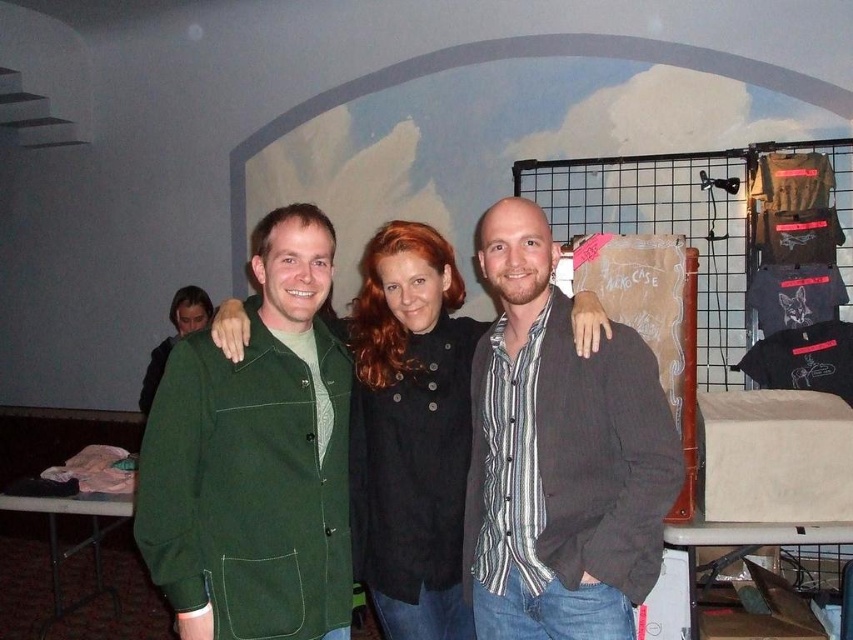
Based on the photo, you are a photographer trying to adjust the lighting for a group photo. You notice the green corduroy jacket at center and the striped cotton shirt at center. Which clothing item is narrower in width?

The green corduroy jacket at center is thinner than the striped cotton shirt at center, so the green corduroy jacket at center is narrower in width.

You are a photographer trying to adjust the spacing between the green corduroy jacket at center and the matte green jacket at left so that they are exactly 2 meters apart. Given their current distance, should you move them closer together or farther apart?

The green corduroy jacket at center is currently 2.45 meters from the matte green jacket at left. To achieve a distance of 2 meters, they should move closer together by 0.45 meters.

You are a photographer trying to adjust the lighting for a group photo. You notice the green corduroy jacket at center and the striped cotton shirt at center in the frame. Which clothing item requires more space in the frame to avoid being cut off?

The striped cotton shirt at center requires more space in the frame because it is larger than the green corduroy jacket at center.